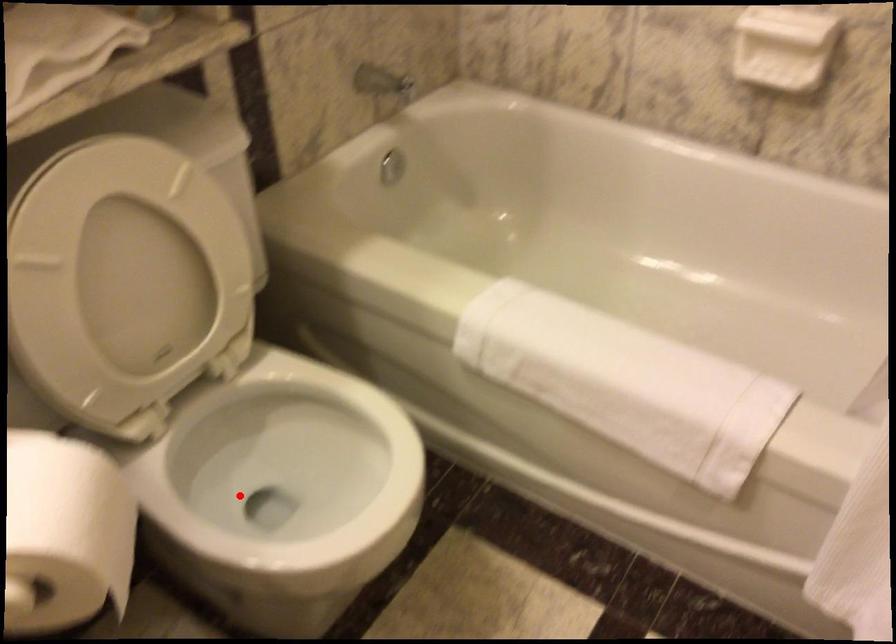
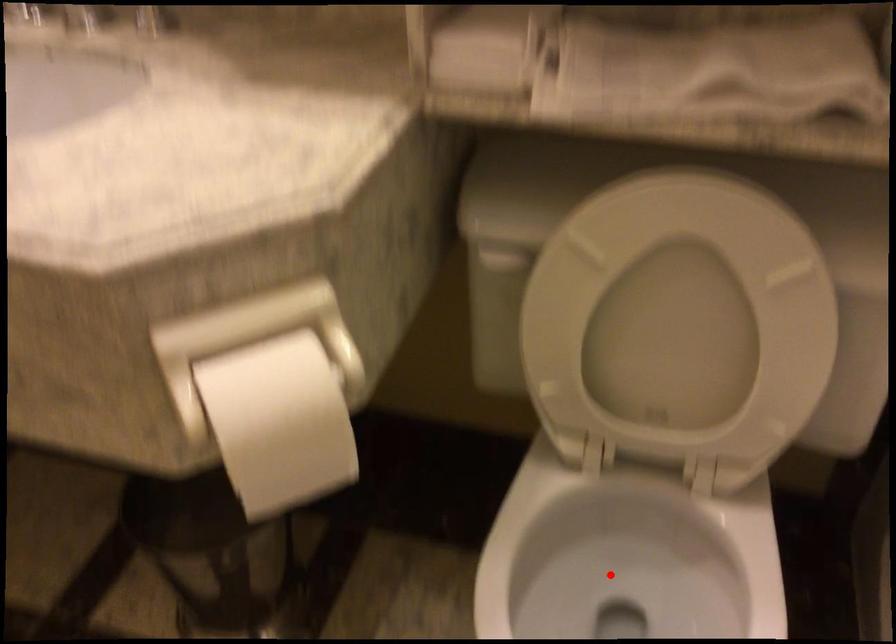
I am providing you with two images of the same scene from different viewpoints. A red point is marked on the first image and another point is marked on the second image. Do the highlighted points in image1 and image2 indicate the same real-world spot?

Yes